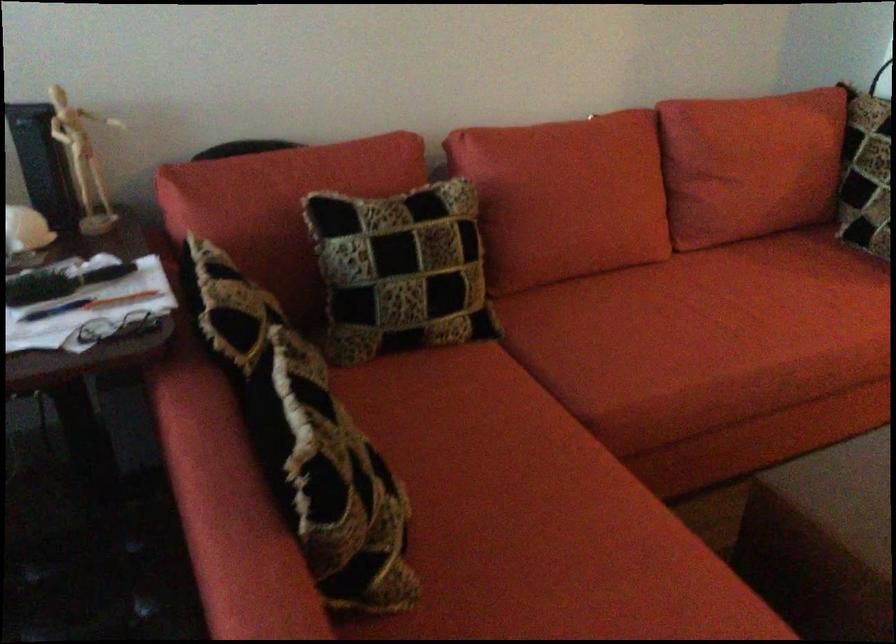
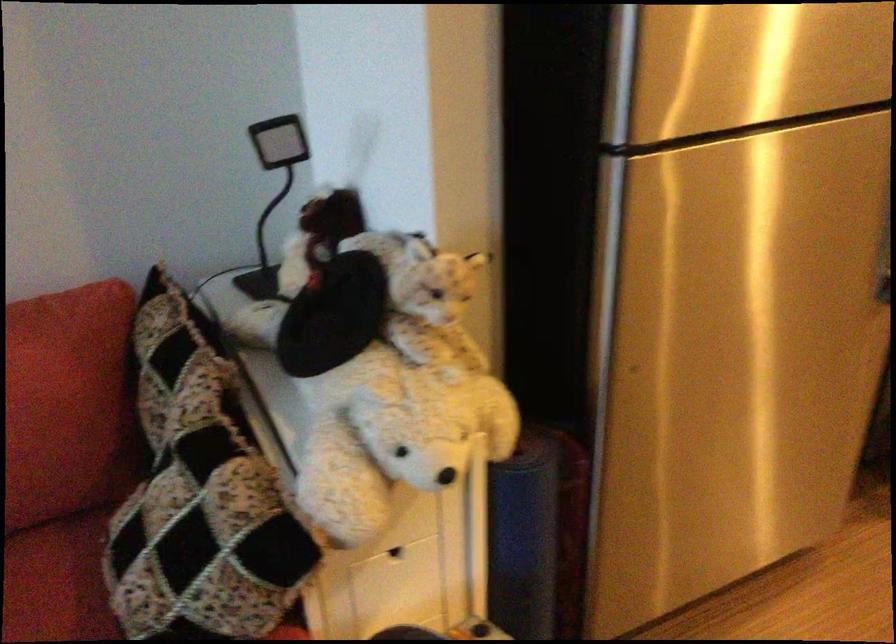
What movement of the cameraman would produce the second image?

The movement direction of the cameraman is right, forward.